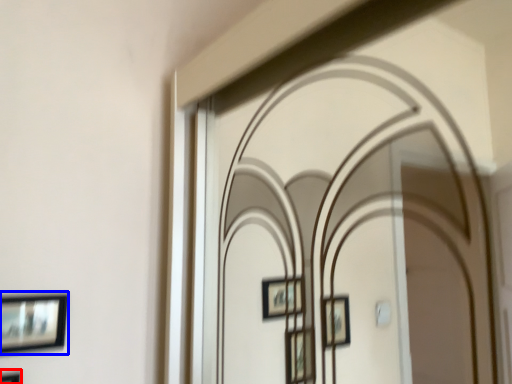
Question: Which object appears closest to the camera in this image, picture frame (highlighted by a red box) or picture frame (highlighted by a blue box)?

Choices:
 (A) picture frame
 (B) picture frame

Answer: (A)